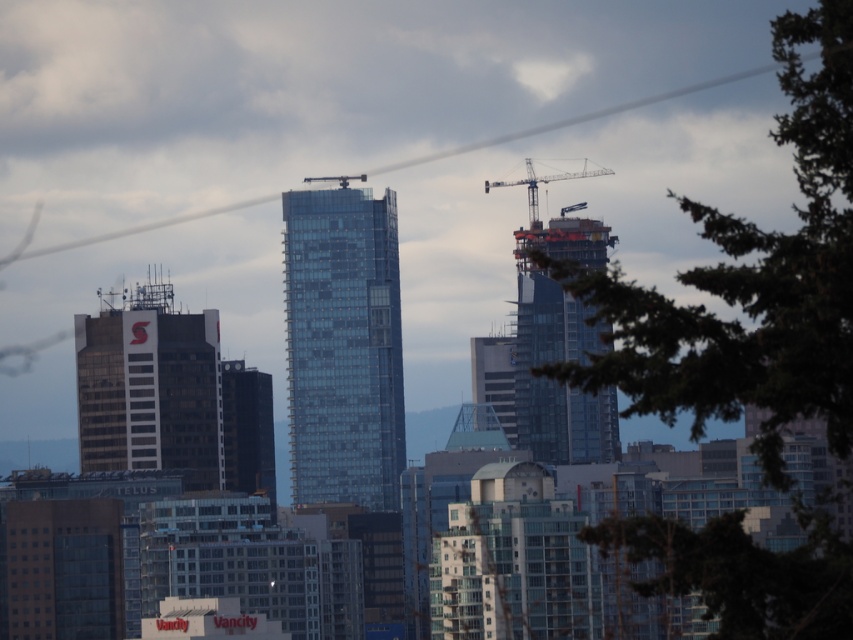
Is green leafy tree at upper right closer to the viewer compared to glassy steel skyscraper at center?

No, it is behind glassy steel skyscraper at center.

Who is more distant from viewer, (817, 406) or (521, 264)?

Positioned behind is point (817, 406).

You are a GUI agent. You are given a task and a screenshot of the screen. Output one action in this format:
    pyautogui.click(x=<x>, y=<y>)
    Task: Click on the green leafy tree at upper right
    This screenshot has width=853, height=640.
    Given the screenshot: What is the action you would take?
    pyautogui.click(x=750, y=282)

Is green leafy tree at upper right to the left of metallic gray crane at upper right from the viewer's perspective?

No, green leafy tree at upper right is not to the left of metallic gray crane at upper right.

Does point (740, 289) lie behind point (570, 177)?

Yes, it is behind point (570, 177).

Locate an element on the screen. green leafy tree at upper right is located at coordinates (750, 282).

Describe the element at coordinates (743, 573) in the screenshot. I see `green leafy tree at center` at that location.

Which is in front, point (706, 557) or point (579, 355)?

Point (579, 355)

Does point (838, 605) lie behind point (524, 380)?

Yes, point (838, 605) is farther from viewer.

Locate an element on the screen. The height and width of the screenshot is (640, 853). green leafy tree at center is located at coordinates (743, 573).